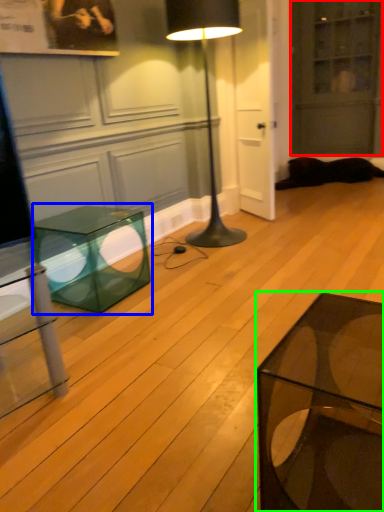
Question: Which object is positioned closest to glass door (highlighted by a red box)? Select from table (highlighted by a blue box) and coffee table (highlighted by a green box).

Choices:
 (A) table
 (B) coffee table

Answer: (A)